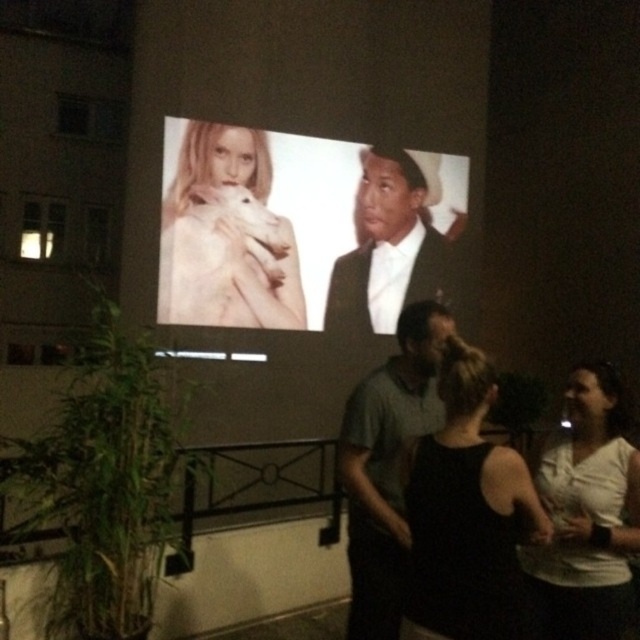
Question: Does white glossy poster at center appear under white satin suit at upper center?

Choices:
 (A) yes
 (B) no

Answer: (B)

Question: Where is white matte shirt at center located in relation to smooth beige scarf at upper left in the image?

Choices:
 (A) right
 (B) left

Answer: (A)

Question: Which of the following is the farthest from the observer?

Choices:
 (A) smooth beige scarf at upper left
 (B) black fabric dress at center
 (C) white glossy poster at center

Answer: (A)

Question: Which is nearer to the black fabric dress at center?

Choices:
 (A) white satin suit at upper center
 (B) white matte shirt at center
 (C) gray cotton shirt at center

Answer: (C)

Question: Among these points, which one is nearest to the camera?

Choices:
 (A) (371, 252)
 (B) (250, 198)
 (C) (202, 205)

Answer: (C)

Question: Does gray cotton shirt at center have a larger size compared to white satin suit at upper center?

Choices:
 (A) no
 (B) yes

Answer: (A)